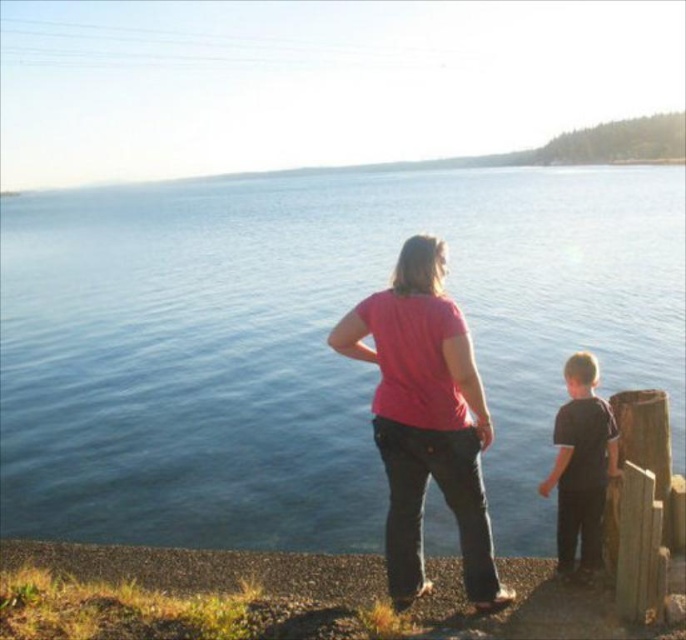
Question: Which point is closer to the camera?

Choices:
 (A) (413, 456)
 (B) (213, 337)

Answer: (A)

Question: Considering the real-world distances, which object is closest to the blue water at center?

Choices:
 (A) pink matte shirt at center
 (B) dark brown fabric shirt at right

Answer: (A)

Question: Which of the following is the closest to the observer?

Choices:
 (A) (320, 344)
 (B) (567, 504)

Answer: (B)

Question: Is pink matte shirt at center further to the viewer compared to dark brown fabric shirt at right?

Choices:
 (A) no
 (B) yes

Answer: (A)

Question: Does blue water at center have a larger size compared to dark brown fabric shirt at right?

Choices:
 (A) no
 (B) yes

Answer: (B)

Question: Is pink matte shirt at center thinner than dark brown fabric shirt at right?

Choices:
 (A) yes
 (B) no

Answer: (B)